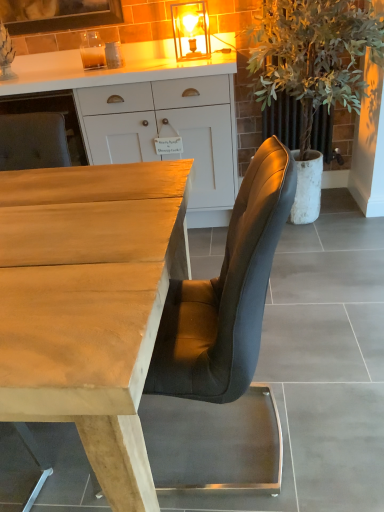
The height and width of the screenshot is (512, 384). I want to click on vacant space situated above light brown wood desk at center (from a real-world perspective), so click(77, 215).